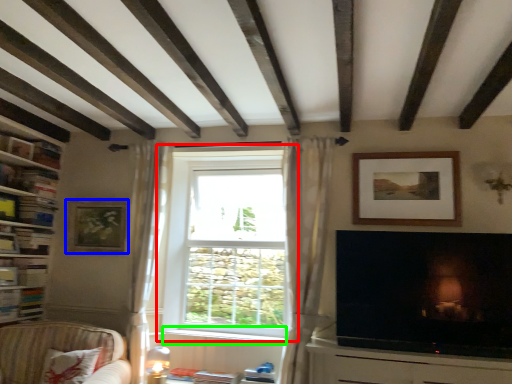
Question: Considering the real-world distances, which object is farthest from window (highlighted by a red box)? picture frame (highlighted by a blue box) or window sill (highlighted by a green box)?

Choices:
 (A) picture frame
 (B) window sill

Answer: (A)